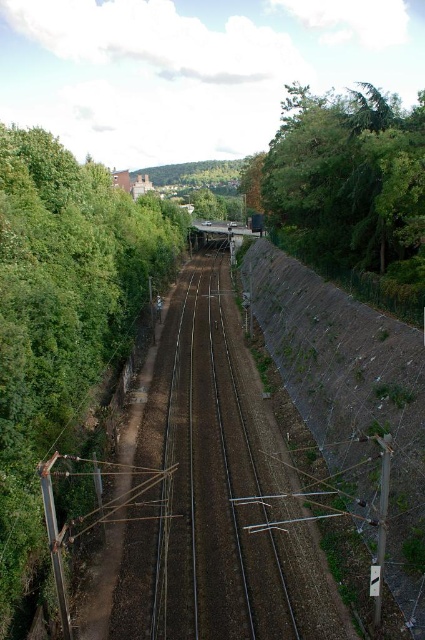
Can you confirm if green leafy tree at left is positioned above brown dirt train track at center?

Yes.

Between point (17, 557) and point (285, 637), which one is positioned in front?

Point (17, 557)

Which is behind, point (81, 163) or point (221, 324)?

Point (221, 324)

Image resolution: width=425 pixels, height=640 pixels. I want to click on green leafy tree at left, so click(61, 320).

Does green leafy tree at left have a greater height compared to green leafy tree at right?

Incorrect, green leafy tree at left's height is not larger of green leafy tree at right's.

What do you see at coordinates (61, 320) in the screenshot? This screenshot has height=640, width=425. I see `green leafy tree at left` at bounding box center [61, 320].

Which is behind, point (31, 225) or point (343, 180)?

Point (343, 180)

Find the location of a particular element. This screenshot has width=425, height=640. green leafy tree at left is located at coordinates (61, 320).

Is brown dirt train track at center positioned before brown textured hillside at right?

No.

Does brown dirt train track at center have a lesser width compared to brown textured hillside at right?

Yes, brown dirt train track at center is thinner than brown textured hillside at right.

Locate an element on the screen. This screenshot has height=640, width=425. brown dirt train track at center is located at coordinates (214, 493).

This screenshot has height=640, width=425. What are the coordinates of `brown dirt train track at center` in the screenshot? It's located at (214, 493).